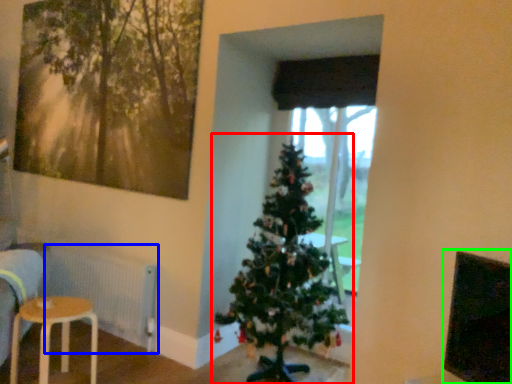
Question: Considering the real-world distances, which object is farthest from christmas tree (highlighted by a red box)? radiator (highlighted by a blue box) or window screen (highlighted by a green box)?

Choices:
 (A) radiator
 (B) window screen

Answer: (B)